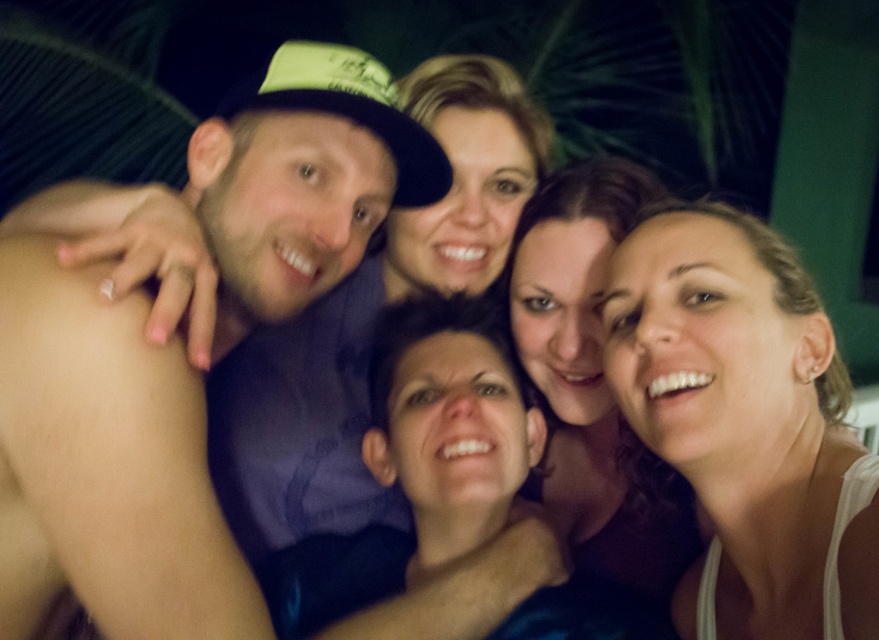
You are a photographer trying to adjust the lighting for a group photo. You notice the matte black hat at upper left and the white matte tank top at center. Which object is covering part of the other?

The matte black hat at upper left is positioned over the white matte tank top at center, so it is covering part of it.

You are a photographer trying to adjust the lighting for a group photo. You notice the white matte tank top at center and the smooth brown hair at center. Which object should you focus more light on to ensure both are well illuminated, considering their sizes?

The white matte tank top at center has a larger width than the smooth brown hair at center, so you should focus more light on the white matte tank top at center to ensure it is well illuminated while also considering the smooth brown hair at center.

You are a photographer who wants to adjust the lighting to highlight the white matte tank top at center. Where exactly should you focus the light? Please provide the coordinates from the scene description.

The white matte tank top at center is located at point (x=746, y=424), so you should focus the light there to highlight it.